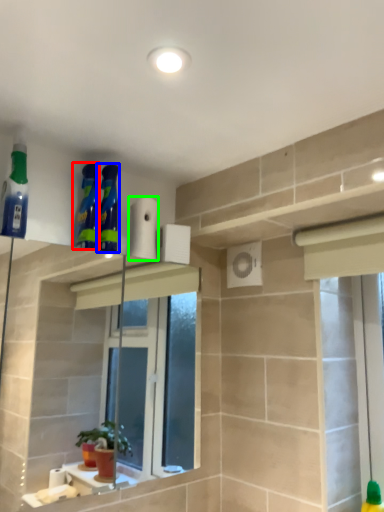
Question: Considering the real-world distances, which object is closest to cleaning product (highlighted by a red box)? cleaning product (highlighted by a blue box) or toilet paper (highlighted by a green box).

Choices:
 (A) cleaning product
 (B) toilet paper

Answer: (A)